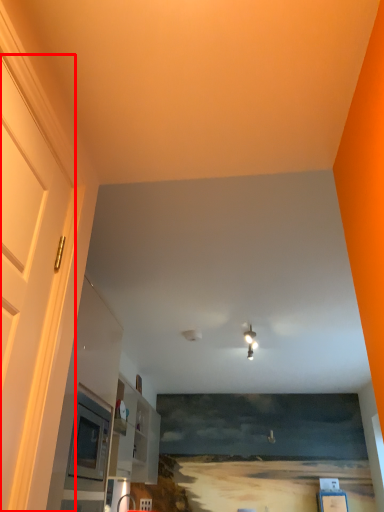
Question: Where is door (annotated by the red box) located in relation to light fixture in the image?

Choices:
 (A) left
 (B) right

Answer: (A)